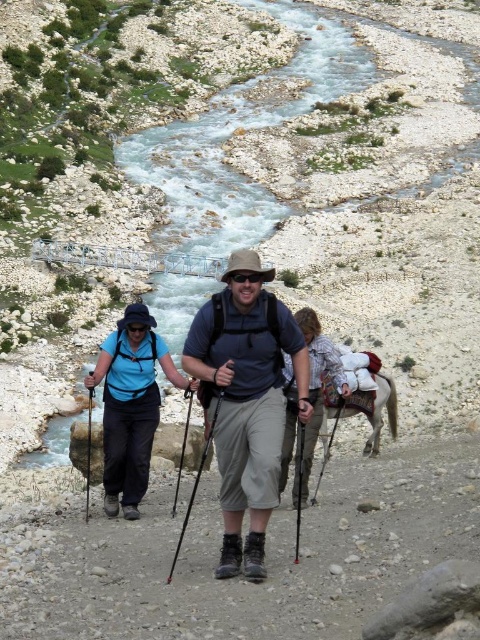
In the scene shown: Is matte blue shirt at center above matte gray shorts at center?

Actually, matte blue shirt at center is below matte gray shorts at center.

Between point (254, 396) and point (224, 336), which one is positioned behind?

The point (224, 336) is behind.

Where is `matte blue shirt at center`? The width and height of the screenshot is (480, 640). matte blue shirt at center is located at coordinates (247, 400).

You are a GUI agent. You are given a task and a screenshot of the screen. Output one action in this format:
    pyautogui.click(x=<x>, y=<y>)
    Task: Click on the matte blue shirt at center
    
    Given the screenshot: What is the action you would take?
    pyautogui.click(x=247, y=400)

Does matte blue shirt at center have a smaller size compared to light brown leather backpack at center?

No.

Is matte blue shirt at center wider than light brown leather backpack at center?

Indeed, matte blue shirt at center has a greater width compared to light brown leather backpack at center.

Is point (241, 289) behind point (313, 349)?

No, it is in front of (313, 349).

Where is `matte blue shirt at center`? This screenshot has height=640, width=480. matte blue shirt at center is located at coordinates (247, 400).

Is gray fabric pants at center smaller than matte gray shorts at center?

Correct, gray fabric pants at center occupies less space than matte gray shorts at center.

Does gray fabric pants at center appear over matte gray shorts at center?

Actually, gray fabric pants at center is below matte gray shorts at center.

Which is in front, point (75, 582) or point (254, 259)?

Point (75, 582) is in front.

Identify the location of gray fabric pants at center. The image size is (480, 640). (266, 557).